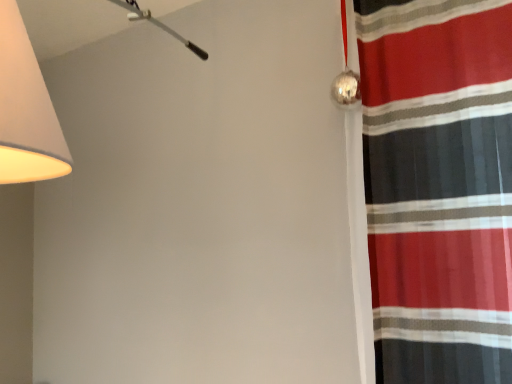
Question: Is matte white lampshade at upper left in front of or behind striped fabric curtain at right in the image?

Choices:
 (A) front
 (B) behind

Answer: (A)

Question: Looking at the image, does matte white lampshade at upper left seem bigger or smaller compared to striped fabric curtain at right?

Choices:
 (A) big
 (B) small

Answer: (A)

Question: From a real-world perspective, is matte white lampshade at upper left physically located above or below striped fabric curtain at right?

Choices:
 (A) above
 (B) below

Answer: (A)

Question: From the image's perspective, is striped fabric curtain at right positioned above or below matte white lampshade at upper left?

Choices:
 (A) above
 (B) below

Answer: (B)

Question: In terms of size, does striped fabric curtain at right appear bigger or smaller than matte white lampshade at upper left?

Choices:
 (A) small
 (B) big

Answer: (A)

Question: From a real-world perspective, is striped fabric curtain at right positioned above or below matte white lampshade at upper left?

Choices:
 (A) above
 (B) below

Answer: (B)

Question: Is striped fabric curtain at right in front of or behind matte white lampshade at upper left in the image?

Choices:
 (A) front
 (B) behind

Answer: (B)